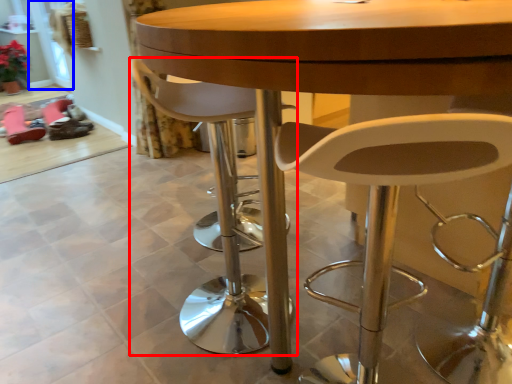
Question: Which of the following is the closest to the observer, chair (highlighted by a red box) or glass door (highlighted by a blue box)?

Choices:
 (A) chair
 (B) glass door

Answer: (A)